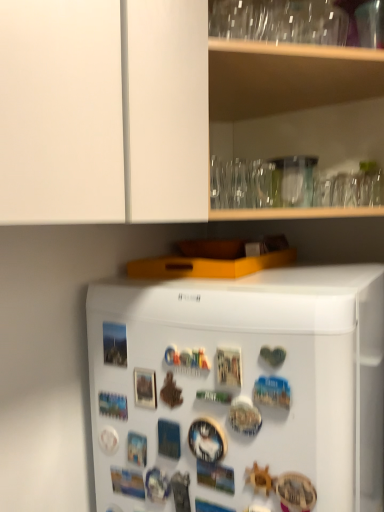
Question: Is transparent glassware at upper center shorter than white matte refrigerator at center?

Choices:
 (A) yes
 (B) no

Answer: (A)

Question: Can you confirm if transparent glassware at upper center is positioned to the left of white matte refrigerator at center?

Choices:
 (A) yes
 (B) no

Answer: (B)

Question: From a real-world perspective, is transparent glassware at upper center on top of white matte refrigerator at center?

Choices:
 (A) no
 (B) yes

Answer: (B)

Question: Can we say transparent glassware at upper center lies outside white matte refrigerator at center?

Choices:
 (A) yes
 (B) no

Answer: (A)

Question: Is transparent glassware at upper center taller than white matte refrigerator at center?

Choices:
 (A) no
 (B) yes

Answer: (A)

Question: Is transparent glassware at upper center surrounding white matte refrigerator at center?

Choices:
 (A) no
 (B) yes

Answer: (A)

Question: Is white matte refrigerator at center at the left side of transparent glassware at upper center?

Choices:
 (A) yes
 (B) no

Answer: (A)

Question: Considering the relative sizes of white matte refrigerator at center and transparent glassware at upper center in the image provided, is white matte refrigerator at center wider than transparent glassware at upper center?

Choices:
 (A) yes
 (B) no

Answer: (A)

Question: Is transparent glassware at upper center inside white matte refrigerator at center?

Choices:
 (A) yes
 (B) no

Answer: (B)

Question: From a real-world perspective, is white matte refrigerator at center below transparent glassware at upper center?

Choices:
 (A) no
 (B) yes

Answer: (B)

Question: Is white matte refrigerator at center bigger than transparent glassware at upper center?

Choices:
 (A) no
 (B) yes

Answer: (B)

Question: Is white matte refrigerator at center in front of transparent glassware at upper center?

Choices:
 (A) no
 (B) yes

Answer: (B)

Question: Choose the correct answer: Is white matte refrigerator at center inside transparent glassware at upper center or outside it?

Choices:
 (A) inside
 (B) outside

Answer: (B)